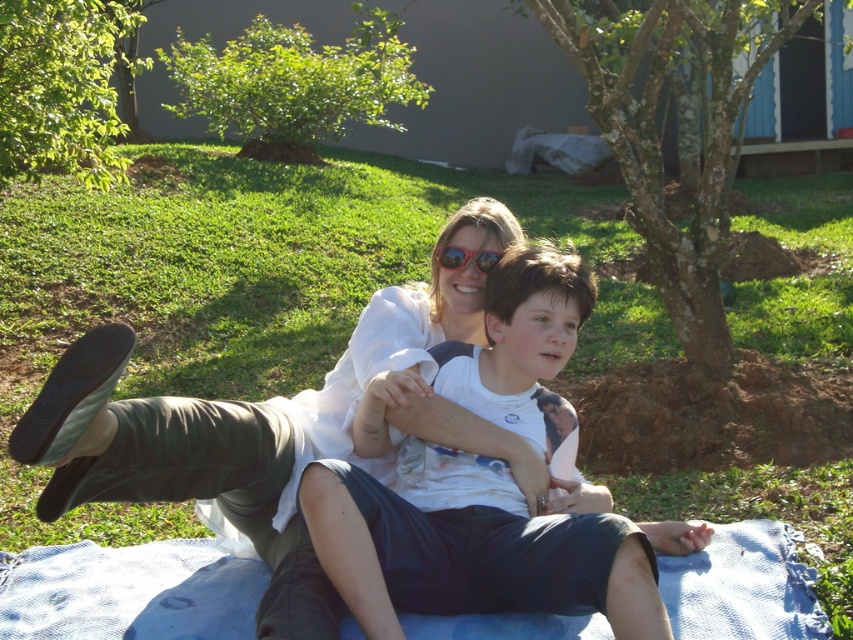
Is point (376, 556) less distant than point (62, 556)?

Yes.

Can you confirm if white cotton shirt at center is bigger than blue woven blanket at lower center?

Indeed, white cotton shirt at center has a larger size compared to blue woven blanket at lower center.

Which is behind, point (360, 570) or point (727, 586)?

The point (727, 586) is more distant.

Identify the location of white cotton shirt at center. 471,547.

Does white cotton shirt at center have a lesser width compared to shiny red sunglasses at center?

In fact, white cotton shirt at center might be wider than shiny red sunglasses at center.

Which of these two, white cotton shirt at center or shiny red sunglasses at center, stands shorter?

Standing shorter between the two is shiny red sunglasses at center.

Between point (503, 400) and point (456, 268), which one is positioned behind?

Point (456, 268)

Find the location of a particular element. white cotton shirt at center is located at coordinates (471, 547).

Can you confirm if blue woven blanket at lower center is smaller than shiny red sunglasses at center?

Incorrect, blue woven blanket at lower center is not smaller in size than shiny red sunglasses at center.

Is blue woven blanket at lower center thinner than shiny red sunglasses at center?

Incorrect, blue woven blanket at lower center's width is not less than shiny red sunglasses at center's.

Who is more distant from viewer, [158,605] or [471,256]?

The point [471,256] is behind.

This screenshot has width=853, height=640. In order to click on blue woven blanket at lower center in this screenshot , I will do `click(129, 592)`.